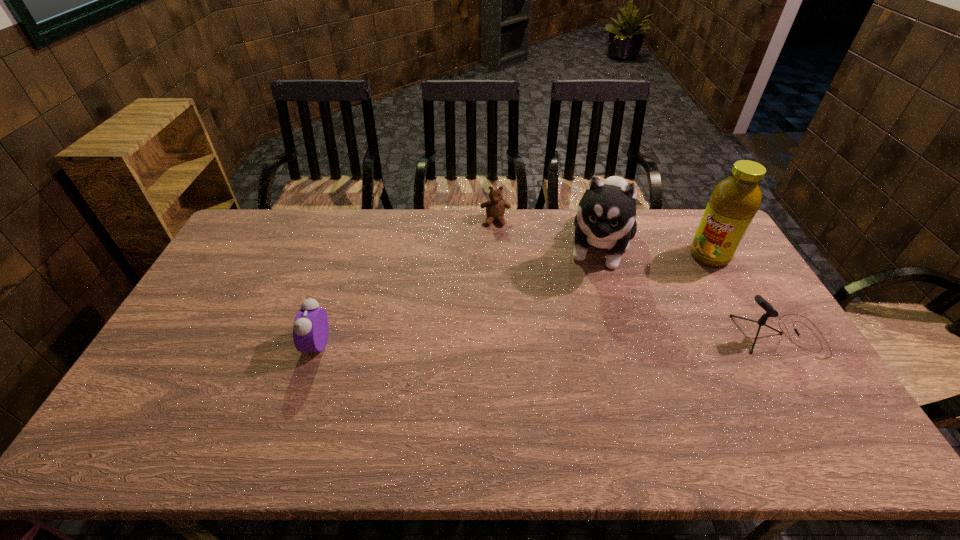
You are a GUI agent. You are given a task and a screenshot of the screen. Output one action in this format:
    pyautogui.click(x=<x>, y=<y>)
    Task: Click on the leftmost object
    The height and width of the screenshot is (540, 960).
    Given the screenshot: What is the action you would take?
    pyautogui.click(x=310, y=329)

The image size is (960, 540). I want to click on microphone, so click(x=770, y=311).

Find the location of `the third object from right to left`. the third object from right to left is located at coordinates (605, 218).

At what (x,y) coordinates should I click in order to perform the action: click on fruit juice. Please return your answer as a coordinate pair (x, y). The width and height of the screenshot is (960, 540). Looking at the image, I should click on (733, 203).

Locate an element on the screen. The height and width of the screenshot is (540, 960). teddy bear is located at coordinates (495, 208).

Where is `free spot located 0.360m on the face of the leftmost object`? free spot located 0.360m on the face of the leftmost object is located at coordinates (180, 343).

I want to click on free space located 0.120m on the face of the leftmost object, so click(x=265, y=343).

Locate an element on the screen. This screenshot has width=960, height=540. vacant space located on the face of the leftmost object is located at coordinates (290, 343).

This screenshot has width=960, height=540. Identify the location of vacant space located 0.260m at the face of the puppy. (579, 342).

You are a GUI agent. You are given a task and a screenshot of the screen. Output one action in this format:
    pyautogui.click(x=<x>, y=<y>)
    Task: Click on the vacant area situated 0.290m at the face of the puppy
    This screenshot has height=540, width=960.
    Given the screenshot: What is the action you would take?
    pyautogui.click(x=577, y=350)